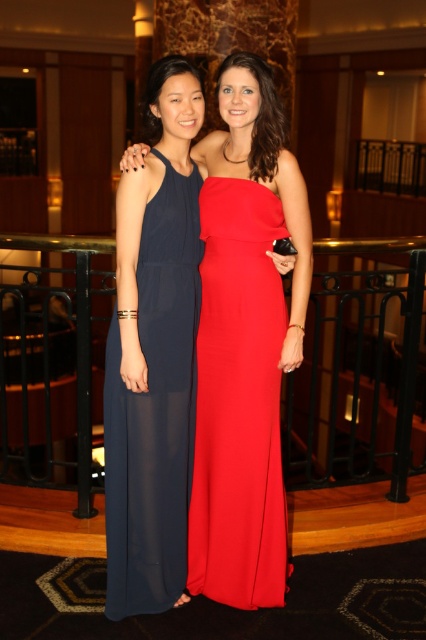
You are a photographer setting up for a photoshoot. You need to adjust the camera focus to capture both the matte black dress at center and the navy sheer dress at left clearly. Since the camera can only focus on one subject at a time, which dress should you focus on to ensure the taller one is sharp?

The matte black dress at center is taller than the navy sheer dress at left. Therefore, you should focus on the matte black dress at center to ensure the taller one is in sharp focus.

You are a photographer standing at the position of the black metal balustrade at center. You want to take a photo of the navy sheer dress at left. Considering the distance between them, is it possible to capture the entire dress in a single frame without moving? Please explain.

The distance between the black metal balustrade at center and the navy sheer dress at left is 5.32 meters. Since the photographer is at the balustrade, they can adjust their camera settings or use a wide enough lens to capture the entire dress from that distance without needing to move.